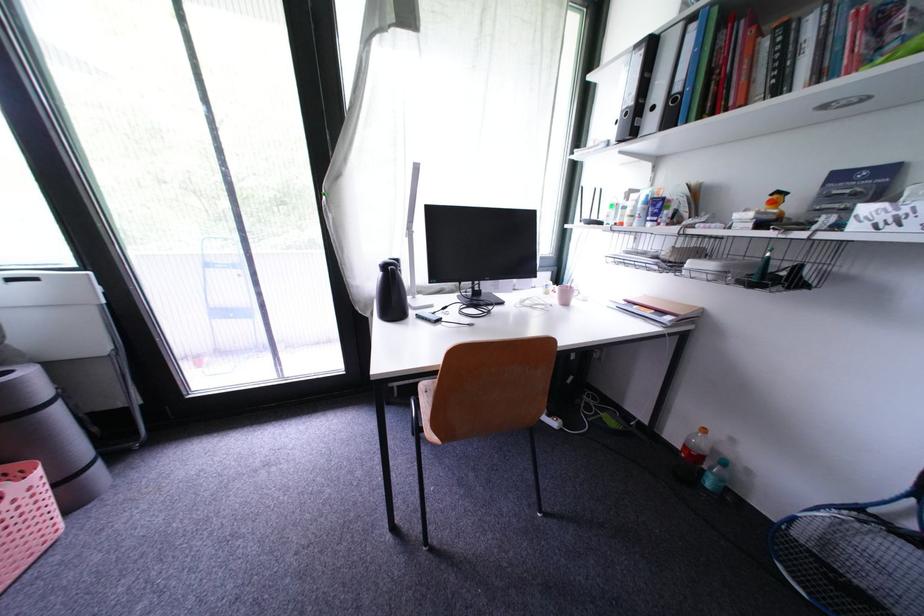
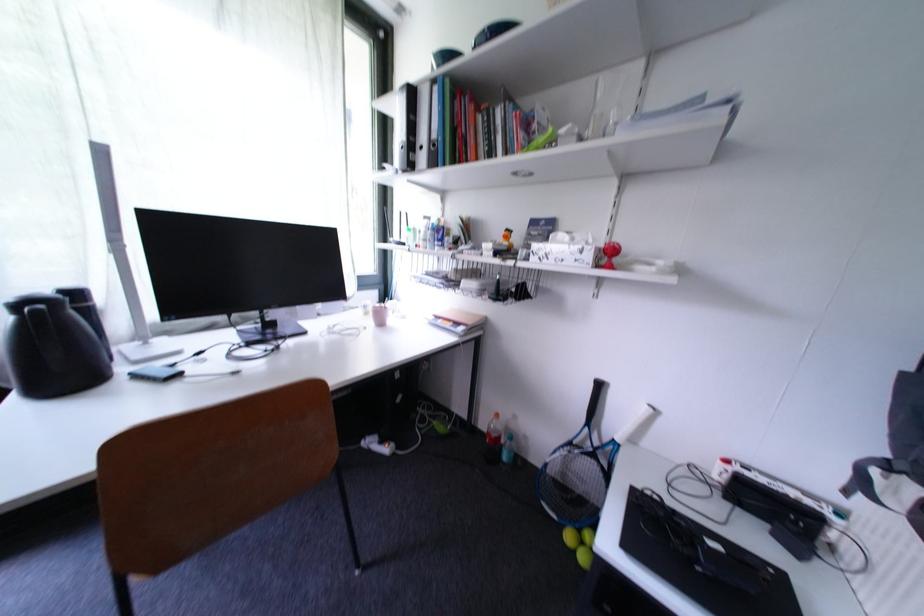
Question: The first image is from the beginning of the video and the second image is from the end. How did the camera likely rotate when shooting the video?

Choices:
 (A) Left
 (B) Right
 (C) Up
 (D) Down

Answer: (B)